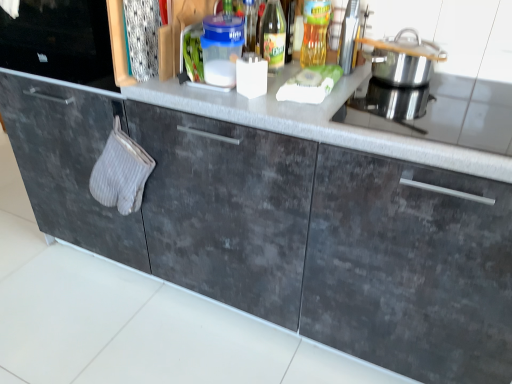
Question: Considering the positions of point (324, 36) and point (260, 44), is point (324, 36) closer or farther from the camera than point (260, 44)?

Choices:
 (A) farther
 (B) closer

Answer: (A)

Question: Would you say transparent glass bottle at center, the second bottle viewed from the left, is to the left or to the right of translucent glass bottle at upper center, which ranks as the first bottle in left-to-right order, in the picture?

Choices:
 (A) right
 (B) left

Answer: (A)

Question: Considering the real-world distances, which object is closest to the silver metallic pot at upper right?

Choices:
 (A) gray textured oven mitt at left
 (B) translucent glass bottle at upper center, the 2th bottle in the right-to-left sequence
 (C) metallic silver toaster at upper right
 (D) transparent glass bottle at center, the second bottle viewed from the left

Answer: (C)

Question: Estimate the real-world distances between objects in this image. Which object is farther from the silver metallic pot at upper right?

Choices:
 (A) metallic silver toaster at upper right
 (B) gray textured oven mitt at left
 (C) transparent glass bottle at center, the second bottle viewed from the left
 (D) translucent glass bottle at upper center, which ranks as the first bottle in left-to-right order

Answer: (B)